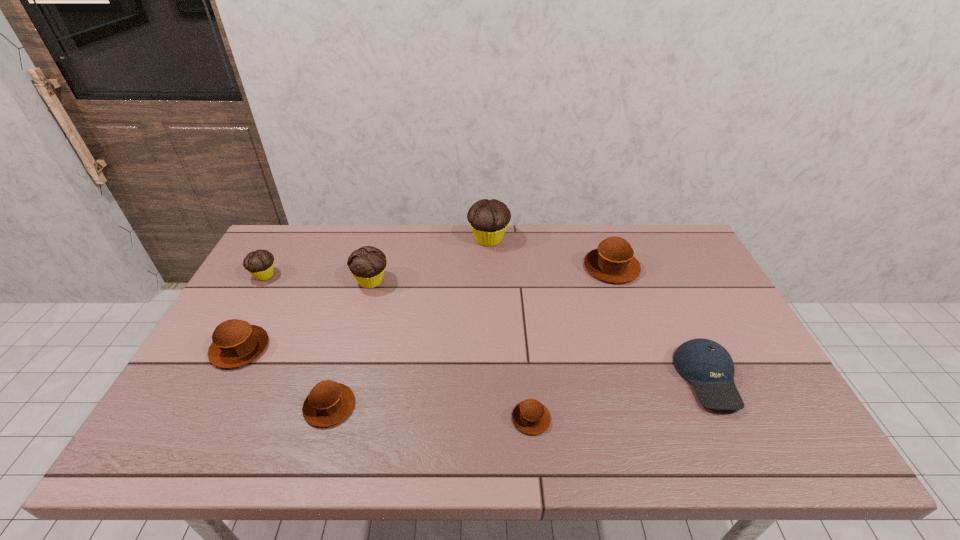
Locate an element on the screen. the tallest object is located at coordinates (488, 219).

Where is `the rightmost chocolate muffin`? The image size is (960, 540). the rightmost chocolate muffin is located at coordinates (488, 219).

Locate an element on the screen. the second chocolate muffin from left to right is located at coordinates point(367,264).

You are a GUI agent. You are given a task and a screenshot of the screen. Output one action in this format:
    pyautogui.click(x=<x>, y=<y>)
    Task: Click on the farthest brown muffin
    
    Given the screenshot: What is the action you would take?
    pyautogui.click(x=613, y=261)

This screenshot has height=540, width=960. I want to click on the biggest brown muffin, so click(x=613, y=261).

Identify the location of the leftmost brown muffin. This screenshot has height=540, width=960. tap(235, 343).

Find the location of `the second farthest brown muffin`. the second farthest brown muffin is located at coordinates (235, 343).

The width and height of the screenshot is (960, 540). In order to click on the smallest chocolate muffin in this screenshot , I will do `click(260, 263)`.

Identify the location of blue baseball cap. (707, 365).

Identify the location of the third biggest brown muffin. Image resolution: width=960 pixels, height=540 pixels. (328, 403).